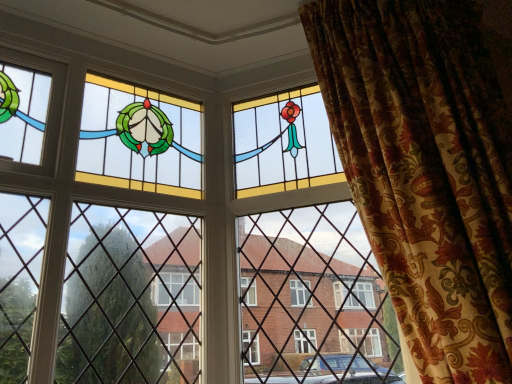
Identify the location of velvet floral curtain at right. (x=426, y=171).

What is the approximate width of velvet floral curtain at right?

velvet floral curtain at right is 25.04 inches in width.

The image size is (512, 384). What do you see at coordinates (426, 171) in the screenshot?
I see `velvet floral curtain at right` at bounding box center [426, 171].

The image size is (512, 384). What do you see at coordinates (169, 240) in the screenshot? I see `stained glass window at center` at bounding box center [169, 240].

Locate an element on the screen. Image resolution: width=512 pixels, height=384 pixels. stained glass window at center is located at coordinates (169, 240).

Find the location of a particular element. velvet floral curtain at right is located at coordinates (426, 171).

Visually, is velvet floral curtain at right positioned to the left or to the right of stained glass window at center?

velvet floral curtain at right is positioned on stained glass window at center's right side.

Is velvet floral curtain at right closer to camera compared to stained glass window at center?

Yes, the depth of velvet floral curtain at right is less than that of stained glass window at center.

Does point (476, 92) come in front of point (332, 340)?

Yes, it is in front of point (332, 340).

From the image's perspective, who appears lower, velvet floral curtain at right or stained glass window at center?

stained glass window at center, from the image's perspective.

From a real-world perspective, who is located lower, velvet floral curtain at right or stained glass window at center?

velvet floral curtain at right.

Is velvet floral curtain at right thinner than stained glass window at center?

No, velvet floral curtain at right is not thinner than stained glass window at center.

In the scene shown: Considering the sizes of objects velvet floral curtain at right and stained glass window at center in the image provided, who is taller, velvet floral curtain at right or stained glass window at center?

Standing taller between the two is velvet floral curtain at right.

Looking at the image, does velvet floral curtain at right seem bigger or smaller compared to stained glass window at center?

Considering their sizes, velvet floral curtain at right takes up more space than stained glass window at center.

Is velvet floral curtain at right outside of stained glass window at center?

Indeed, velvet floral curtain at right is completely outside stained glass window at center.

Are velvet floral curtain at right and stained glass window at center located far from each other?

No.

Is velvet floral curtain at right looking in the opposite direction of stained glass window at center?

No, stained glass window at center is not at the back of velvet floral curtain at right.

Where is `window below the velvet floral curtain at right (from the image's perspective)`? window below the velvet floral curtain at right (from the image's perspective) is located at coordinates (169, 240).

Does stained glass window at center appear on the right side of velvet floral curtain at right?

In fact, stained glass window at center is to the left of velvet floral curtain at right.

Which is in front, stained glass window at center or velvet floral curtain at right?

velvet floral curtain at right.

Considering the positions of points (178, 128) and (435, 48), is point (178, 128) farther from camera compared to point (435, 48)?

Yes, point (178, 128) is farther from viewer.

From the image's perspective, which one is positioned lower, stained glass window at center or velvet floral curtain at right?

stained glass window at center, from the image's perspective.

From a real-world perspective, who is located higher, stained glass window at center or velvet floral curtain at right?

stained glass window at center.

Considering the relative sizes of stained glass window at center and velvet floral curtain at right in the image provided, is stained glass window at center wider than velvet floral curtain at right?

No.

In terms of height, does stained glass window at center look taller or shorter compared to velvet floral curtain at right?

In the image, stained glass window at center appears to be shorter than velvet floral curtain at right.

Can you confirm if stained glass window at center is smaller than velvet floral curtain at right?

Yes.

In the scene shown: Is velvet floral curtain at right a part of stained glass window at center?

No, velvet floral curtain at right is not inside stained glass window at center.

Is stained glass window at center not close to velvet floral curtain at right?

No, stained glass window at center is not far from velvet floral curtain at right.

From the picture: Is stained glass window at center turned away from velvet floral curtain at right?

No, stained glass window at center is not facing the opposite direction of velvet floral curtain at right.

How far apart are stained glass window at center and velvet floral curtain at right?

They are 58.67 centimeters apart.

The height and width of the screenshot is (384, 512). Identify the location of curtain that appears in front of the stained glass window at center. (426, 171).

Image resolution: width=512 pixels, height=384 pixels. Identify the location of curtain above the stained glass window at center (from the image's perspective). (426, 171).

This screenshot has height=384, width=512. In order to click on curtain on the right side of stained glass window at center in this screenshot , I will do `click(426, 171)`.